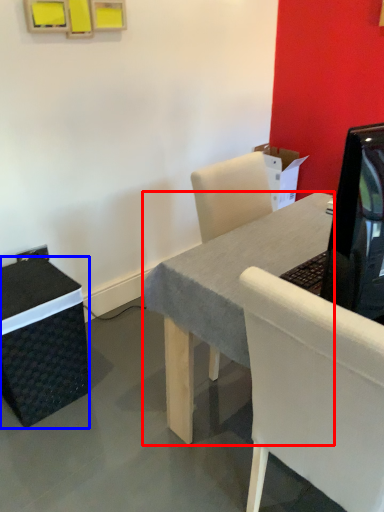
Question: Which of the following is the farthest to the observer, desk (highlighted by a red box) or box (highlighted by a blue box)?

Choices:
 (A) desk
 (B) box

Answer: (B)